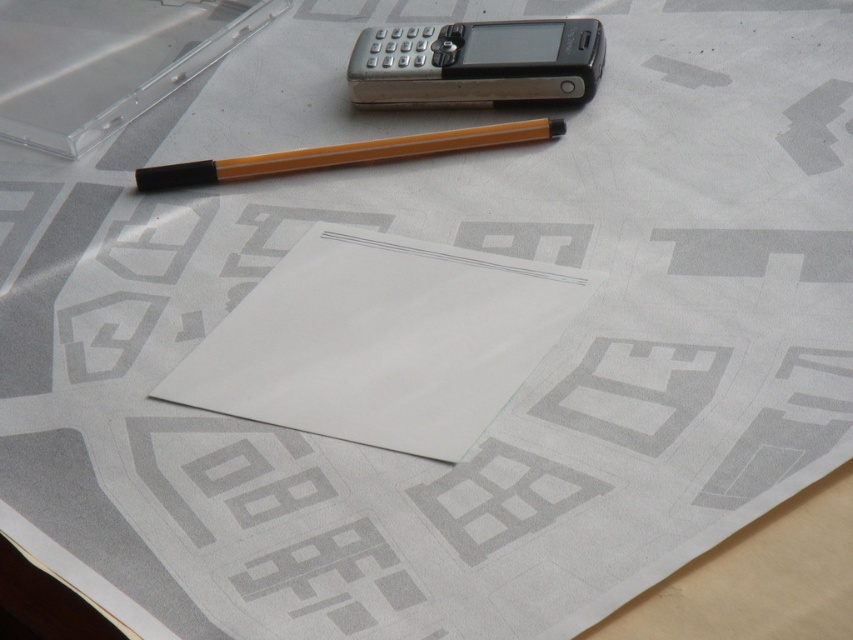
Between silver metallic smartphone at center and rubber eraser at center, which one is positioned higher?

silver metallic smartphone at center is higher up.

Who is more forward, (552, 68) or (572, 80)?

Point (552, 68)

Where is `silver metallic smartphone at center`? This screenshot has height=640, width=853. silver metallic smartphone at center is located at coordinates (474, 61).

Does white paper at center come in front of yellow striped pencil at center?

Yes, it is.

Does white paper at center have a greater height compared to yellow striped pencil at center?

Yes.

In order to click on white paper at center in this screenshot , I will do `click(381, 340)`.

Is white paper at center above rubber eraser at center?

Incorrect, white paper at center is not positioned above rubber eraser at center.

Can you confirm if white paper at center is taller than rubber eraser at center?

Yes, white paper at center is taller than rubber eraser at center.

Find the location of `white paper at center`. white paper at center is located at coordinates (381, 340).

I want to click on white paper at center, so click(381, 340).